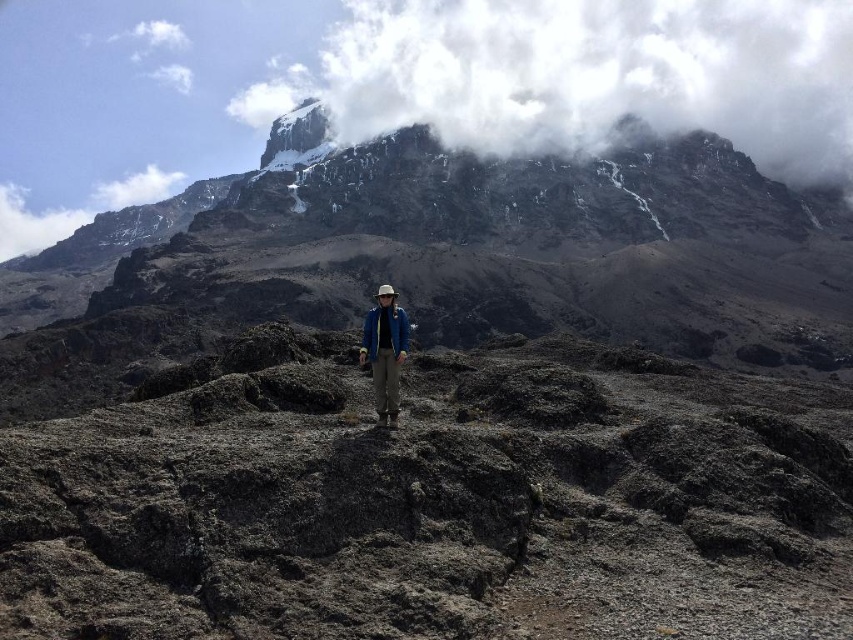
Question: Is rugged rock mountain at center further to the viewer compared to white fluffy cloud at upper center?

Choices:
 (A) no
 (B) yes

Answer: (A)

Question: From the image, what is the correct spatial relationship of dark gray rock at center in relation to white fluffy cloud at upper center?

Choices:
 (A) right
 (B) left

Answer: (B)

Question: Which object is farther from the camera taking this photo?

Choices:
 (A) white fluffy cloud at upper center
 (B) rugged rock mountain at center

Answer: (A)

Question: Does dark gray rock at center appear over matte blue jacket at center?

Choices:
 (A) no
 (B) yes

Answer: (A)

Question: Which is nearer to the dark gray rock at center?

Choices:
 (A) white fluffy cloud at upper center
 (B) matte blue jacket at center
 (C) rugged rock mountain at center

Answer: (B)

Question: Which object is positioned closest to the rugged rock mountain at center?

Choices:
 (A) white fluffy cloud at upper center
 (B) dark gray rock at center

Answer: (A)